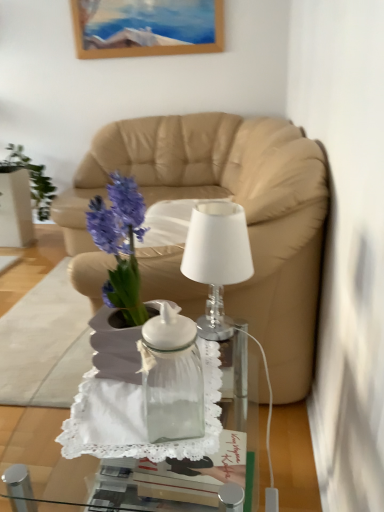
Where is `free spot above transparent glass jar at center (from a real-world perspective)`? The image size is (384, 512). free spot above transparent glass jar at center (from a real-world perspective) is located at coordinates (147, 402).